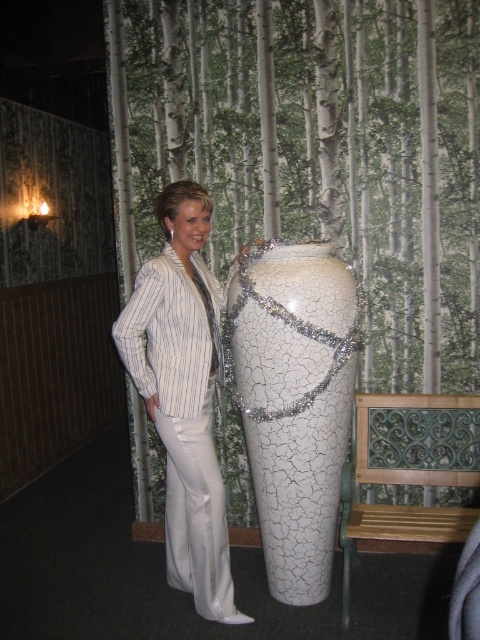
Is cracked white vase at center to the left of white satin suit at center from the viewer's perspective?

Incorrect, cracked white vase at center is not on the left side of white satin suit at center.

Where is `cracked white vase at center`? This screenshot has width=480, height=640. cracked white vase at center is located at coordinates (294, 403).

You are a GUI agent. You are given a task and a screenshot of the screen. Output one action in this format:
    pyautogui.click(x=<x>, y=<y>)
    Task: Click on the cracked white vase at center
    The image size is (480, 640).
    Given the screenshot: What is the action you would take?
    pyautogui.click(x=294, y=403)